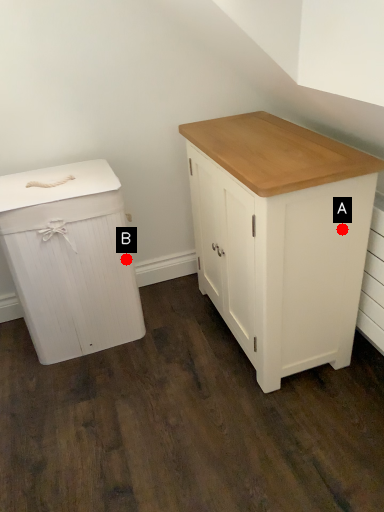
Question: Two points are circled on the image, labeled by A and B beside each circle. Which of the following is the farthest from the observer?

Choices:
 (A) A is further
 (B) B is further

Answer: (B)